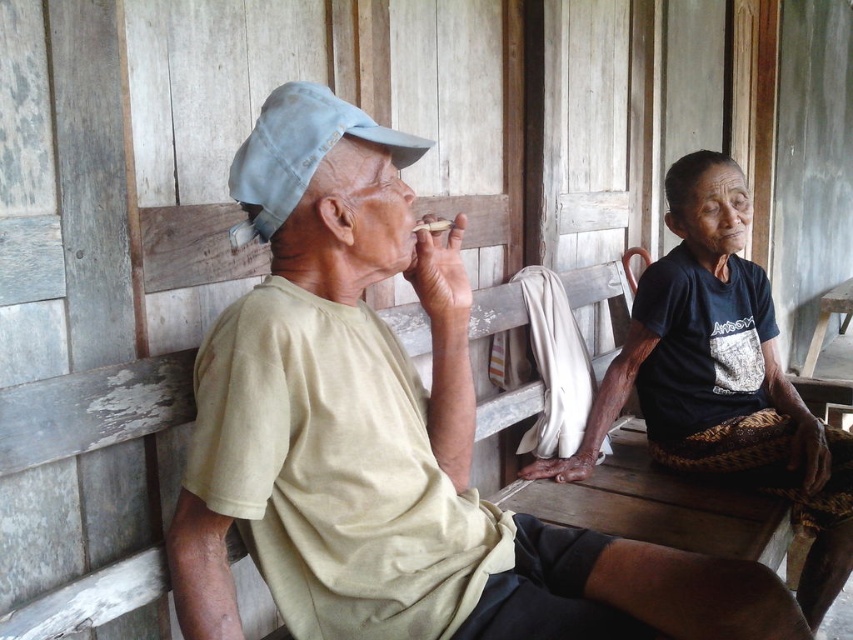
Question: Which of the following is the closest to the observer?

Choices:
 (A) beige cotton shirt at left
 (B) dark blue fabric shirt at center

Answer: (A)

Question: Is beige cotton shirt at left wider than dark blue fabric shirt at center?

Choices:
 (A) no
 (B) yes

Answer: (B)

Question: Is the position of beige cotton shirt at left more distant than that of dark blue fabric shirt at center?

Choices:
 (A) no
 (B) yes

Answer: (A)

Question: Where is beige cotton shirt at left located in relation to dark blue fabric shirt at center in the image?

Choices:
 (A) above
 (B) below

Answer: (A)

Question: Which object is closer to the camera taking this photo?

Choices:
 (A) beige cotton shirt at left
 (B) dark blue fabric shirt at center

Answer: (A)